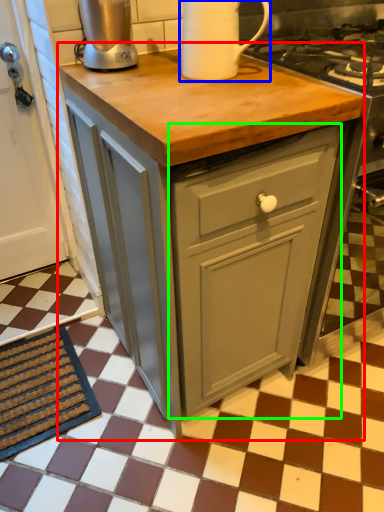
Question: Considering the real-world distances, which object is closest to table (highlighted by a red box)? kitchen appliance (highlighted by a blue box) or cabinetry (highlighted by a green box).

Choices:
 (A) kitchen appliance
 (B) cabinetry

Answer: (B)